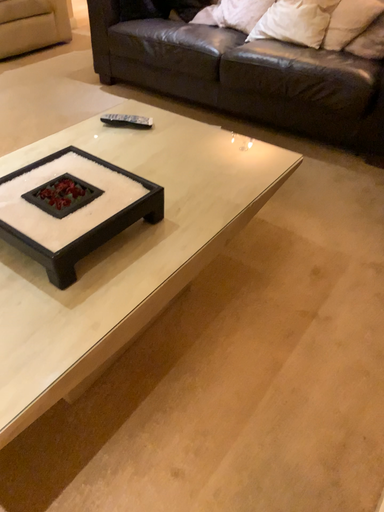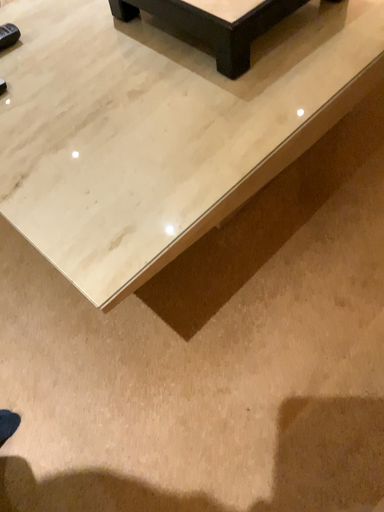
Question: Which way did the camera rotate in the video?

Choices:
 (A) rotated right
 (B) rotated left

Answer: (B)